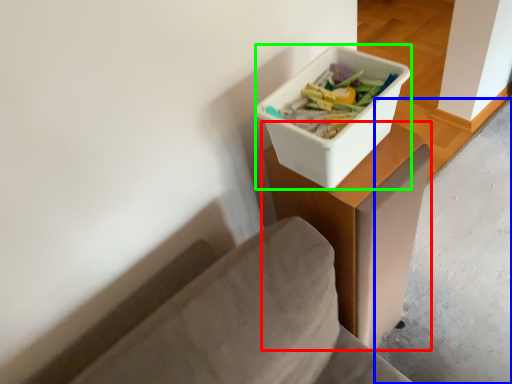
Question: Based on their relative distances, which object is nearer to table (highlighted by a red box)? Choose from concrete (highlighted by a blue box) and storage box (highlighted by a green box).

Choices:
 (A) concrete
 (B) storage box

Answer: (B)